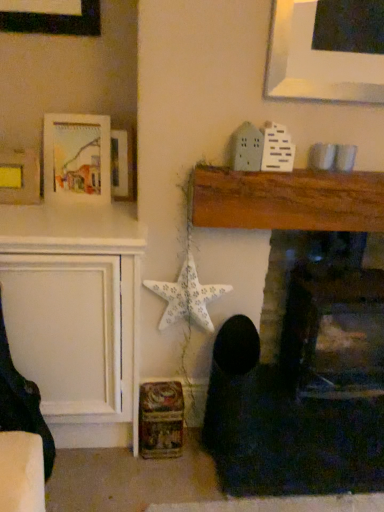
Question: Is matte yellow paper at upper left, marked as the 1th picture frame in a left-to-right arrangement, completely or partially outside of wooden fireplace at center, the 2th fireplace in the right-to-left sequence?

Choices:
 (A) no
 (B) yes

Answer: (B)

Question: From the image's perspective, is matte yellow paper at upper left, which ranks as the third picture frame in right-to-left order, over wooden fireplace at center, the 1th fireplace positioned from the left?

Choices:
 (A) no
 (B) yes

Answer: (B)

Question: Would you consider matte yellow paper at upper left, which ranks as the third picture frame in right-to-left order, to be distant from wooden fireplace at center, the 2th fireplace in the right-to-left sequence?

Choices:
 (A) no
 (B) yes

Answer: (B)

Question: Can you confirm if matte yellow paper at upper left, which ranks as the third picture frame in right-to-left order, is wider than wooden fireplace at center, the 1th fireplace positioned from the left?

Choices:
 (A) no
 (B) yes

Answer: (B)

Question: Can you confirm if matte yellow paper at upper left, marked as the 1th picture frame in a left-to-right arrangement, is shorter than wooden fireplace at center, the 1th fireplace positioned from the left?

Choices:
 (A) no
 (B) yes

Answer: (B)

Question: Is wooden fireplace at center, the 2th fireplace in the right-to-left sequence, wider or thinner than smooth stone fireplace at center, which is the second fireplace in left-to-right order?

Choices:
 (A) thin
 (B) wide

Answer: (A)

Question: Considering the positions of wooden fireplace at center, the 2th fireplace in the right-to-left sequence, and smooth stone fireplace at center, which is the second fireplace in left-to-right order, in the image, is wooden fireplace at center, the 2th fireplace in the right-to-left sequence, taller or shorter than smooth stone fireplace at center, which is the second fireplace in left-to-right order,?

Choices:
 (A) short
 (B) tall

Answer: (B)

Question: From a real-world perspective, is wooden fireplace at center, the 1th fireplace positioned from the left, positioned above or below smooth stone fireplace at center, which is the second fireplace in left-to-right order?

Choices:
 (A) above
 (B) below

Answer: (A)

Question: From the image's perspective, relative to smooth stone fireplace at center, which is the second fireplace in left-to-right order, is wooden fireplace at center, the 1th fireplace positioned from the left, above or below?

Choices:
 (A) above
 (B) below

Answer: (A)

Question: Considering their positions, is matte yellow paper at upper left, which ranks as the third picture frame in right-to-left order, located in front of or behind wooden picture frame at upper left, which is the third picture frame in left-to-right order?

Choices:
 (A) front
 (B) behind

Answer: (A)

Question: Is matte yellow paper at upper left, marked as the 1th picture frame in a left-to-right arrangement, wider or thinner than wooden picture frame at upper left, which is the third picture frame in left-to-right order?

Choices:
 (A) wide
 (B) thin

Answer: (A)

Question: Considering the positions of matte yellow paper at upper left, which ranks as the third picture frame in right-to-left order, and wooden picture frame at upper left, which is the third picture frame in left-to-right order, in the image, is matte yellow paper at upper left, which ranks as the third picture frame in right-to-left order, taller or shorter than wooden picture frame at upper left, which is the third picture frame in left-to-right order,?

Choices:
 (A) tall
 (B) short

Answer: (B)

Question: Is point (13, 167) closer or farther from the camera than point (114, 165)?

Choices:
 (A) closer
 (B) farther

Answer: (A)

Question: Do you think wooden picture frame at upper left, which is the third picture frame in left-to-right order, is within white paper star at center-left, or outside of it?

Choices:
 (A) inside
 (B) outside

Answer: (B)

Question: From a real-world perspective, relative to white paper star at center-left, is wooden picture frame at upper left, which is the third picture frame in left-to-right order, vertically above or below?

Choices:
 (A) above
 (B) below

Answer: (A)